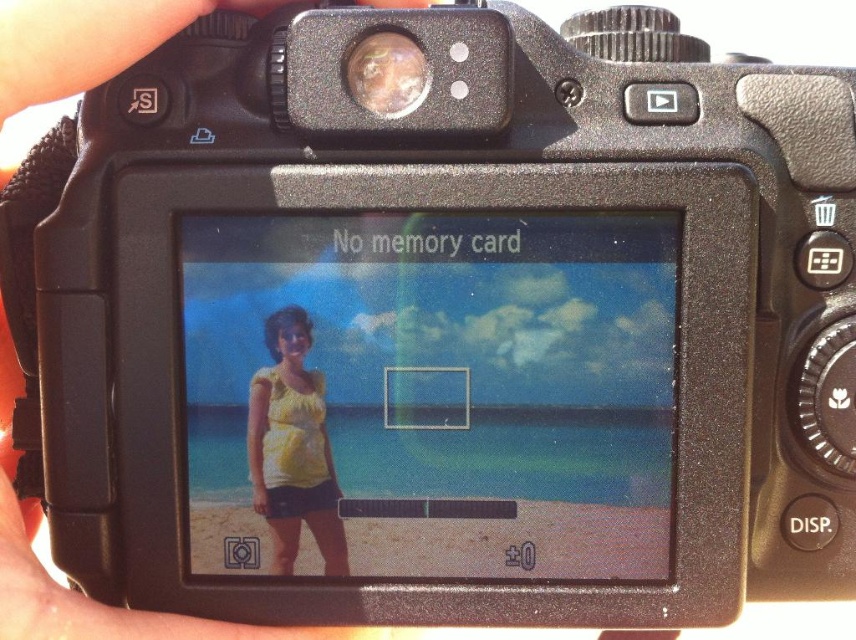
Question: Which point is closer to the camera taking this photo?

Choices:
 (A) (288, 307)
 (B) (415, 77)

Answer: (B)

Question: Among these points, which one is farthest from the camera?

Choices:
 (A) (301, 324)
 (B) (396, 81)

Answer: (A)

Question: Which point is closer to the camera?

Choices:
 (A) yellow cotton shirt at center
 (B) metallic reflective lens at upper center

Answer: (B)

Question: Does yellow cotton shirt at center have a larger size compared to metallic reflective lens at upper center?

Choices:
 (A) no
 (B) yes

Answer: (B)

Question: Can you confirm if yellow cotton shirt at center is positioned above metallic reflective lens at upper center?

Choices:
 (A) no
 (B) yes

Answer: (A)

Question: Can you confirm if yellow cotton shirt at center is bigger than metallic reflective lens at upper center?

Choices:
 (A) no
 (B) yes

Answer: (B)